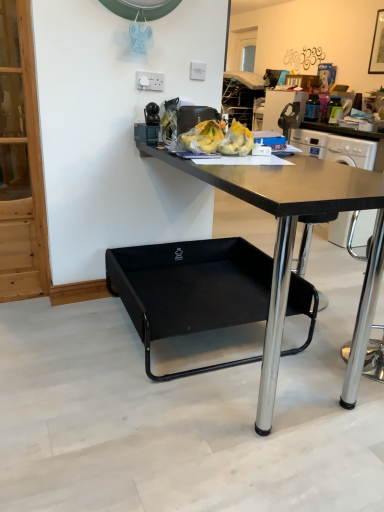
Where is `yellow plastic bananas at center`? Image resolution: width=384 pixels, height=512 pixels. yellow plastic bananas at center is located at coordinates (219, 139).

Identify the location of white plastic power outlet at upper center, which is the first power outlet from back to front. (197, 71).

The height and width of the screenshot is (512, 384). What do you see at coordinates (190, 290) in the screenshot?
I see `black fabric swivel chair at lower center` at bounding box center [190, 290].

The height and width of the screenshot is (512, 384). In order to click on black glass picture frame at upper right in this screenshot , I will do [377, 46].

Is the position of metallic black coffee machine at upper right less distant than that of matte black tray at upper center?

No, metallic black coffee machine at upper right is further to the viewer.

Based on the photo, is metallic black coffee machine at upper right next to matte black tray at upper center and touching it?

No.

Which object is positioned more to the left, metallic black coffee machine at upper right or matte black tray at upper center?

Positioned to the left is matte black tray at upper center.

Choose the correct answer: Is metallic black coffee machine at upper right inside matte black tray at upper center or outside it?

metallic black coffee machine at upper right lies outside matte black tray at upper center.

Looking at this image, between white plastic power outlet at upper center, the 2th power outlet when ordered from back to front, and yellow plastic bananas at center, which one has more height?

Standing taller between the two is yellow plastic bananas at center.

Considering the relative sizes of white plastic power outlet at upper center, the 1th power outlet in the left-to-right sequence, and yellow plastic bananas at center in the image provided, is white plastic power outlet at upper center, the 1th power outlet in the left-to-right sequence, wider than yellow plastic bananas at center?

In fact, white plastic power outlet at upper center, the 1th power outlet in the left-to-right sequence, might be narrower than yellow plastic bananas at center.

From a real-world perspective, is white plastic power outlet at upper center, the 2th power outlet when ordered from back to front, over yellow plastic bananas at center?

Yes, from a real-world perspective, white plastic power outlet at upper center, the 2th power outlet when ordered from back to front, is over yellow plastic bananas at center

Where is `food below the white plastic power outlet at upper center, which appears as the 2th power outlet when viewed from the right (from a real-world perspective)`? This screenshot has width=384, height=512. food below the white plastic power outlet at upper center, which appears as the 2th power outlet when viewed from the right (from a real-world perspective) is located at coordinates (219, 139).

Does metallic black coffee machine at upper right turn towards white plastic power outlet at upper center, which is counted as the 1th power outlet, starting from the front?

No.

Do you think metallic black coffee machine at upper right is within white plastic power outlet at upper center, the 2th power outlet when ordered from back to front, or outside of it?

metallic black coffee machine at upper right exists outside the volume of white plastic power outlet at upper center, the 2th power outlet when ordered from back to front.

Considering the positions of points (298, 124) and (163, 79), is point (298, 124) closer to camera compared to point (163, 79)?

That is False.

Image resolution: width=384 pixels, height=512 pixels. Find the location of `the 2nd power outlet directly beneath the black glass picture frame at upper right (from a real-world perspective)`. the 2nd power outlet directly beneath the black glass picture frame at upper right (from a real-world perspective) is located at coordinates (149, 81).

Considering the relative positions of white plastic power outlet at upper center, which is counted as the 1th power outlet, starting from the front, and black glass picture frame at upper right in the image provided, is white plastic power outlet at upper center, which is counted as the 1th power outlet, starting from the front, in front of black glass picture frame at upper right?

Yes, the depth of white plastic power outlet at upper center, which is counted as the 1th power outlet, starting from the front, is less than that of black glass picture frame at upper right.

Which object is positioned more to the left, white plastic power outlet at upper center, which is counted as the 1th power outlet, starting from the front, or black glass picture frame at upper right?

Positioned to the left is white plastic power outlet at upper center, which is counted as the 1th power outlet, starting from the front.

From a real-world perspective, is white plastic power outlet at upper center, which is counted as the 1th power outlet, starting from the front, physically below black glass picture frame at upper right?

Yes, from a real-world perspective, white plastic power outlet at upper center, which is counted as the 1th power outlet, starting from the front, is under black glass picture frame at upper right.

Is white plastic power outlet at upper center, the 2th power outlet in the front-to-back sequence, wider or thinner than black fabric swivel chair at lower center?

white plastic power outlet at upper center, the 2th power outlet in the front-to-back sequence, is thinner than black fabric swivel chair at lower center.

Between point (203, 64) and point (237, 309), which one is positioned in front?

The point (237, 309) is closer to the camera.

Which object is positioned more to the left, yellow plastic bananas at center or black glass picture frame at upper right?

Positioned to the left is yellow plastic bananas at center.

In the image, is yellow plastic bananas at center positioned in front of or behind black glass picture frame at upper right?

Clearly, yellow plastic bananas at center is in front of black glass picture frame at upper right.

Are yellow plastic bananas at center and black glass picture frame at upper right located far from each other?

Yes, yellow plastic bananas at center is far from black glass picture frame at upper right.

Is yellow plastic bananas at center positioned beyond the bounds of metallic black coffee machine at upper right?

Indeed, yellow plastic bananas at center is completely outside metallic black coffee machine at upper right.

From a real-world perspective, who is located higher, yellow plastic bananas at center or metallic black coffee machine at upper right?

yellow plastic bananas at center, from a real-world perspective.

Who is shorter, yellow plastic bananas at center or metallic black coffee machine at upper right?

yellow plastic bananas at center is shorter.

From the image's perspective, is yellow plastic bananas at center beneath metallic black coffee machine at upper right?

Yes, from the image's perspective, yellow plastic bananas at center is below metallic black coffee machine at upper right.

The image size is (384, 512). Identify the location of appliance located above the matte black tray at upper center (from the image's perspective). (281, 106).

At what (x,y) coordinates should I click in order to perform the action: click on food below the white plastic power outlet at upper center, which appears as the 2th power outlet when viewed from the right (from a real-world perspective). Please return your answer as a coordinate pair (x, y). The image size is (384, 512). Looking at the image, I should click on (219, 139).

Based on their spatial positions, is matte black tray at upper center or black matte desk at center closer to black glass picture frame at upper right?

matte black tray at upper center is closer to black glass picture frame at upper right.

Consider the image. Based on their spatial positions, is white plastic power outlet at upper center, which appears as the 2th power outlet when viewed from the right, or white plastic power outlet at upper center, the 2th power outlet in the front-to-back sequence, closer to matte black tray at upper center?

white plastic power outlet at upper center, which appears as the 2th power outlet when viewed from the right, lies closer to matte black tray at upper center than the other object.

Estimate the real-world distances between objects in this image. Which object is further from black matte desk at center, black fabric swivel chair at lower center or matte black tray at upper center?

matte black tray at upper center is further to black matte desk at center.

When comparing their distances from black fabric swivel chair at lower center, does metallic black coffee machine at upper right or matte black tray at upper center seem closer?

matte black tray at upper center is positioned closer to the anchor black fabric swivel chair at lower center.

Consider the image. Based on their spatial positions, is yellow plastic bananas at center or white plastic power outlet at upper center, the 2th power outlet in the front-to-back sequence, further from black matte desk at center?

white plastic power outlet at upper center, the 2th power outlet in the front-to-back sequence.

In the scene shown: Estimate the real-world distances between objects in this image. Which object is closer to matte black tray at upper center, white plastic power outlet at upper center, the 1th power outlet in the left-to-right sequence, or metallic black coffee machine at upper right?

Among the two, white plastic power outlet at upper center, the 1th power outlet in the left-to-right sequence, is located nearer to matte black tray at upper center.

Which object lies nearer to the anchor point white plastic power outlet at upper center, which is the first power outlet from back to front, black matte desk at center or black fabric swivel chair at lower center?

Based on the image, black fabric swivel chair at lower center appears to be nearer to white plastic power outlet at upper center, which is the first power outlet from back to front.

Based on their spatial positions, is matte black tray at upper center or black glass picture frame at upper right closer to metallic black coffee machine at upper right?

Based on the image, black glass picture frame at upper right appears to be nearer to metallic black coffee machine at upper right.

You are a GUI agent. You are given a task and a screenshot of the screen. Output one action in this format:
    pyautogui.click(x=<x>, y=<y>)
    Task: Click on the food located between black fabric swivel chair at lower center and black glass picture frame at upper right in the depth direction
    
    Given the screenshot: What is the action you would take?
    219,139

This screenshot has height=512, width=384. Find the location of `tableware positioned between black matte desk at center and black glass picture frame at upper right from near to far`. tableware positioned between black matte desk at center and black glass picture frame at upper right from near to far is located at coordinates (146, 134).

Where is `picture frame between white plastic power outlet at upper center, the 1th power outlet in the left-to-right sequence, and metallic black coffee machine at upper right, along the z-axis`? picture frame between white plastic power outlet at upper center, the 1th power outlet in the left-to-right sequence, and metallic black coffee machine at upper right, along the z-axis is located at coordinates (377, 46).

The height and width of the screenshot is (512, 384). I want to click on desk between white plastic power outlet at upper center, which appears as the 2th power outlet when viewed from the right, and black fabric swivel chair at lower center from top to bottom, so click(x=294, y=244).